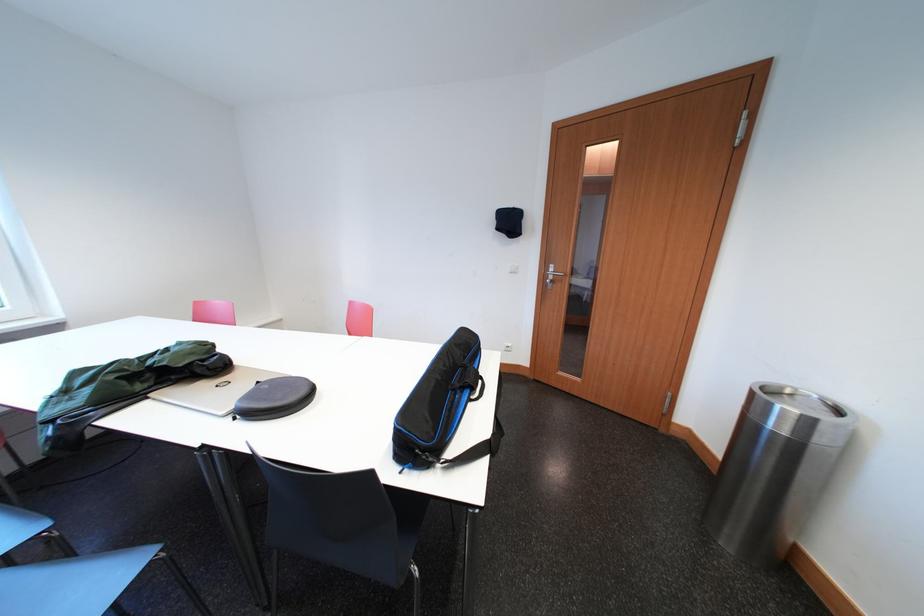
Locate an element on the screen. Image resolution: width=924 pixels, height=616 pixels. blue chair sitting surface is located at coordinates (407, 523).